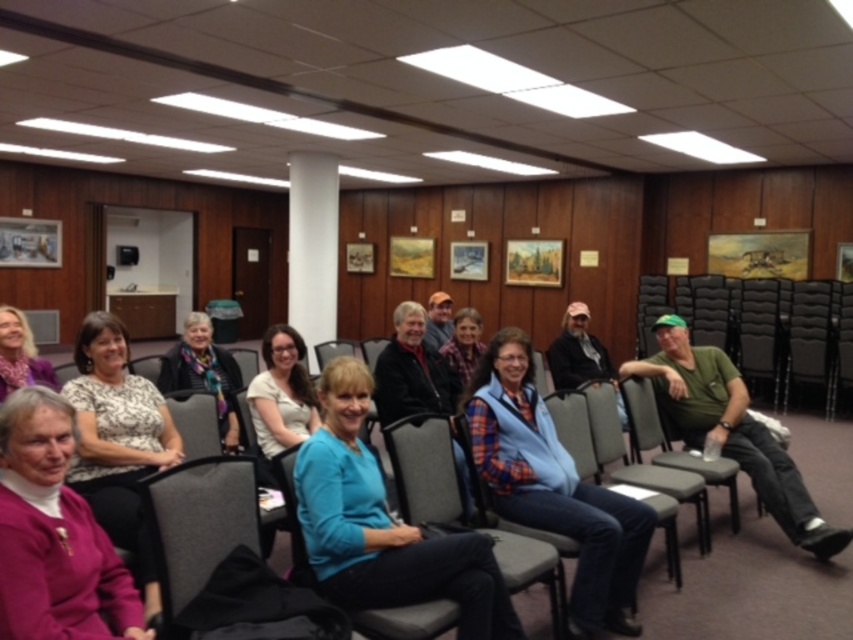
You are standing at the entrance of the conference room and see the point marked as point (x=554, y=486). What object is located at this point?

The blue plaid vest at center is located at point (x=554, y=486).